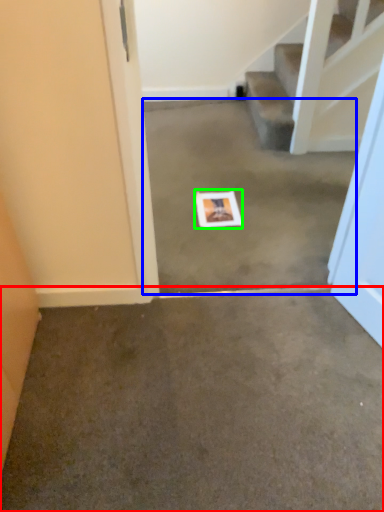
Question: Which object is positioned farthest from concrete (highlighted by a red box)? Select from concrete (highlighted by a blue box) and postcard (highlighted by a green box).

Choices:
 (A) concrete
 (B) postcard

Answer: (B)